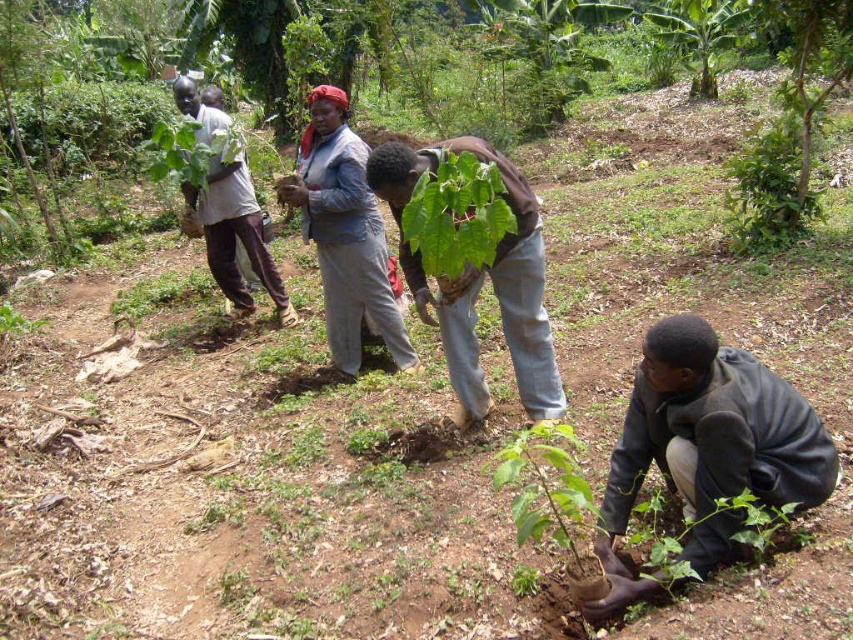
You are a hiker who has just arrived at this tree planting site. You notice the light gray fabric at center and the green leafy plant at lower center. Which object is taller?

The light gray fabric at center is taller than the green leafy plant at lower center according to the description.